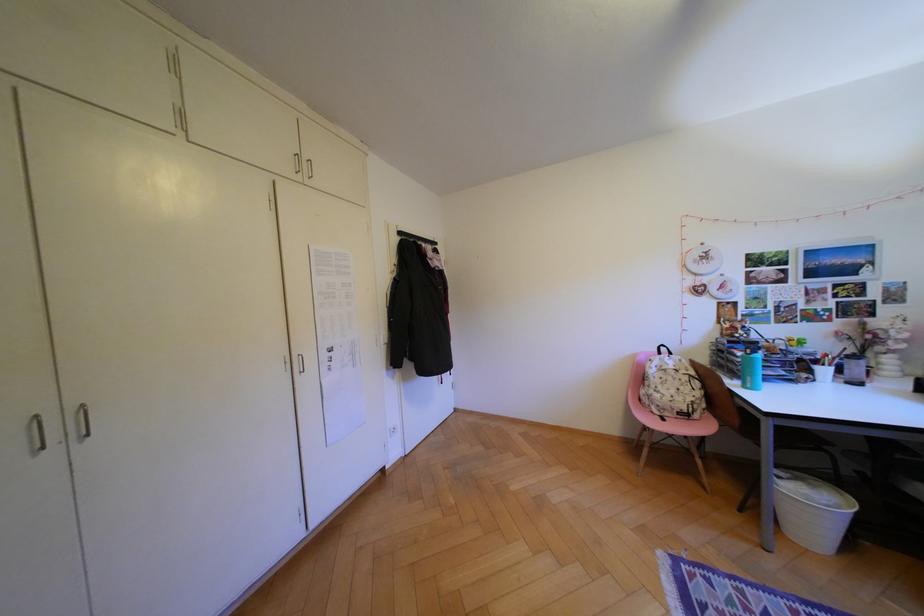
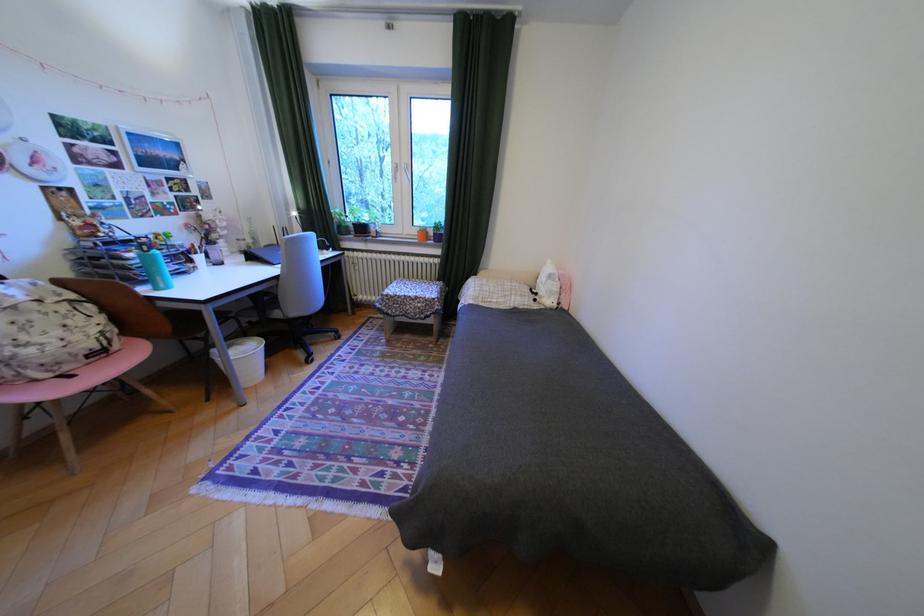
In the second image, find the point that corresponds to (751,354) in the first image.

(140, 254)